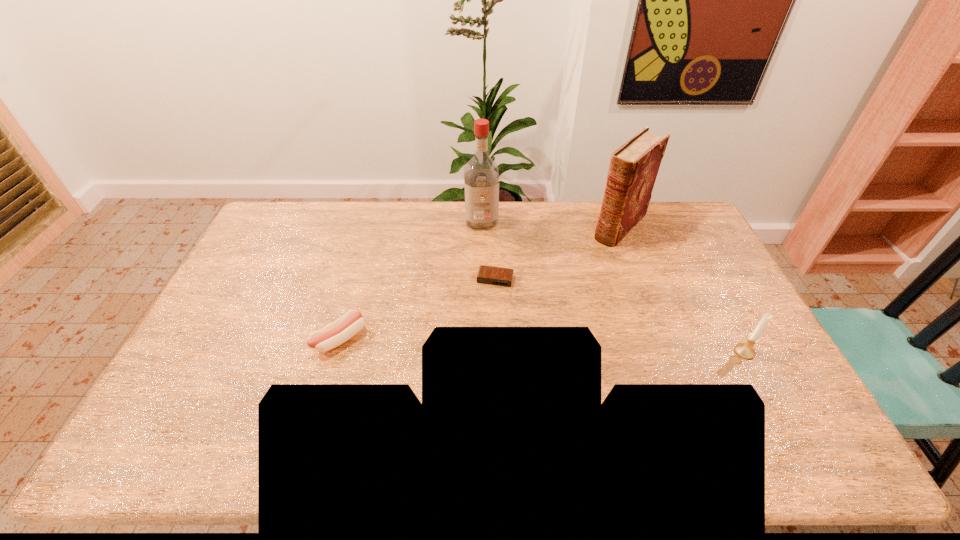
At what (x,y) coordinates should I click in order to perform the action: click on vacant space located on the front of the candle holder. Please return your answer as a coordinate pair (x, y). Looking at the image, I should click on (775, 409).

Where is `free space located 0.060m on the spine side of the fourth shortest object`? free space located 0.060m on the spine side of the fourth shortest object is located at coordinates (598, 251).

Where is `free space located on the spine side of the fourth shortest object`? free space located on the spine side of the fourth shortest object is located at coordinates (582, 267).

Image resolution: width=960 pixels, height=540 pixels. I want to click on vacant space located on the spine side of the fourth shortest object, so click(x=544, y=303).

Find the location of a particular element. The height and width of the screenshot is (540, 960). vacant space located on the front-facing side of the liquor is located at coordinates (485, 258).

The height and width of the screenshot is (540, 960). I want to click on vacant region located 0.200m on the front-facing side of the liquor, so [486, 268].

Where is `vacant region located 0.140m on the front-facing side of the liquor`? This screenshot has height=540, width=960. vacant region located 0.140m on the front-facing side of the liquor is located at coordinates (485, 256).

Locate an element on the screen. free space located 0.070m on the front face of the third farthest object is located at coordinates (489, 303).

Locate an element on the screen. The image size is (960, 540). vacant space located on the front face of the third farthest object is located at coordinates (479, 346).

Identify the location of free point located on the front face of the third farthest object. Image resolution: width=960 pixels, height=540 pixels. (490, 298).